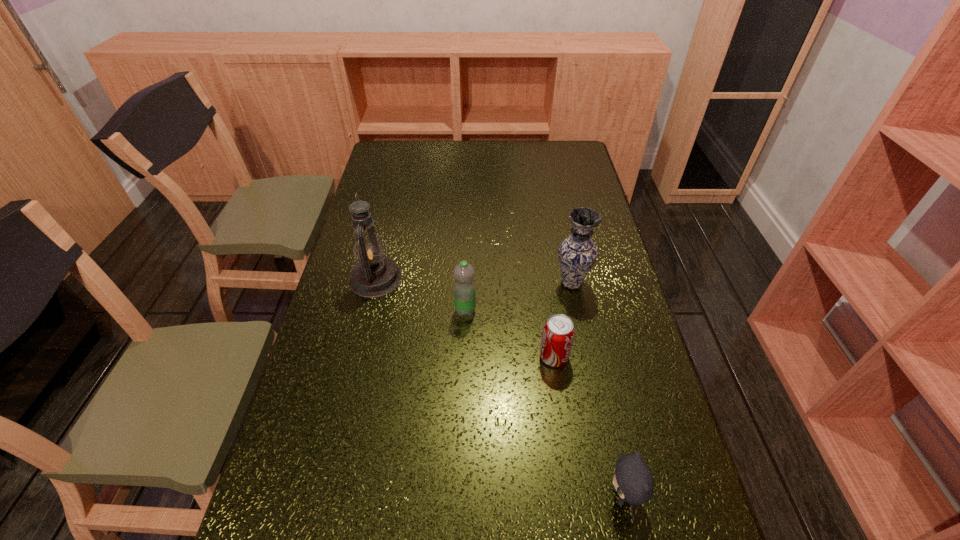
This screenshot has width=960, height=540. Identify the location of vacant space positioned on the right of the second nearest object. (611, 356).

What are the coordinates of `free location located 0.280m on the front-facing side of the nearest object` in the screenshot? It's located at (471, 496).

In order to click on blank space located on the front-facing side of the nearest object in this screenshot , I will do `click(467, 496)`.

The width and height of the screenshot is (960, 540). Identify the location of blank area located on the front-facing side of the nearest object. (414, 496).

Find the location of a particular element. object that is at the left edge is located at coordinates (373, 275).

Where is `vase located at the right edge`? This screenshot has height=540, width=960. vase located at the right edge is located at coordinates (577, 254).

I want to click on kitten located at the right edge, so click(633, 481).

You are a GUI agent. You are given a task and a screenshot of the screen. Output one action in this format:
    pyautogui.click(x=<x>, y=<y>)
    Task: Click on the free space at the far edge of the desktop
    
    Given the screenshot: What is the action you would take?
    pyautogui.click(x=516, y=145)

In order to click on free space at the left edge of the desktop in this screenshot , I will do `click(391, 183)`.

Locate an element on the screen. This screenshot has width=960, height=540. vacant space at the right edge of the desktop is located at coordinates (601, 432).